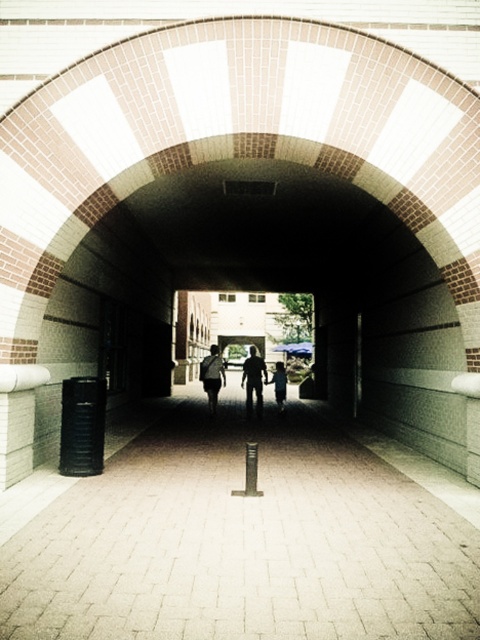
Question: From the image, what is the correct spatial relationship of dark gray fabric jacket at center in relation to matte black backpack at center?

Choices:
 (A) left
 (B) right

Answer: (B)

Question: Can you confirm if dark gray fabric jacket at center is wider than matte black backpack at center?

Choices:
 (A) no
 (B) yes

Answer: (A)

Question: Does brick pavement at center appear on the left side of matte black backpack at center?

Choices:
 (A) yes
 (B) no

Answer: (B)

Question: Which point is farther to the camera?

Choices:
 (A) (297, 572)
 (B) (282, 394)
 (C) (251, 355)
 (D) (207, 392)

Answer: (C)

Question: Which of the following is the farthest from the observer?

Choices:
 (A) matte black backpack at center
 (B) dark gray fabric jacket at center
 (C) brick pavement at center

Answer: (A)

Question: Which of the following is the closest to the observer?

Choices:
 (A) dark gray fabric jacket at center
 (B) matte black backpack at center

Answer: (A)